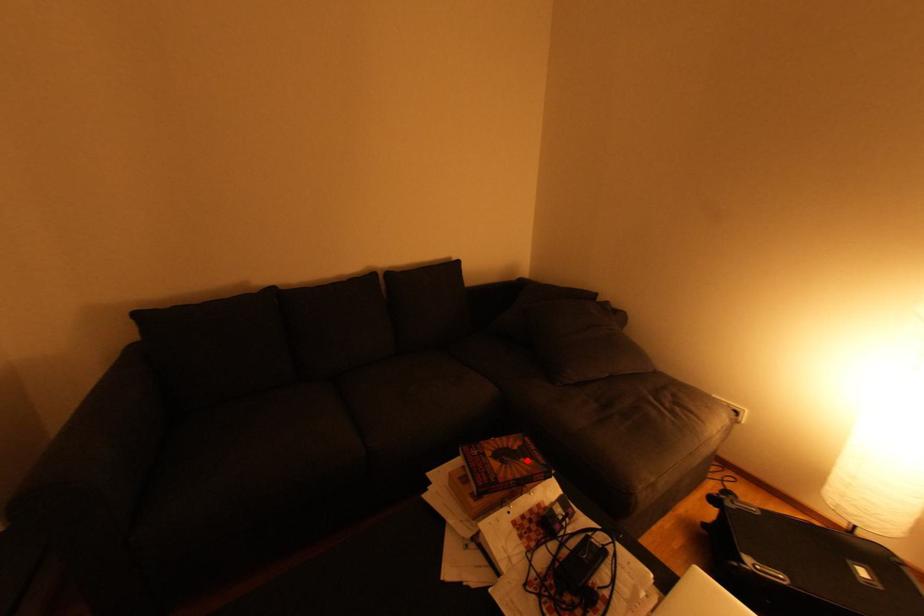
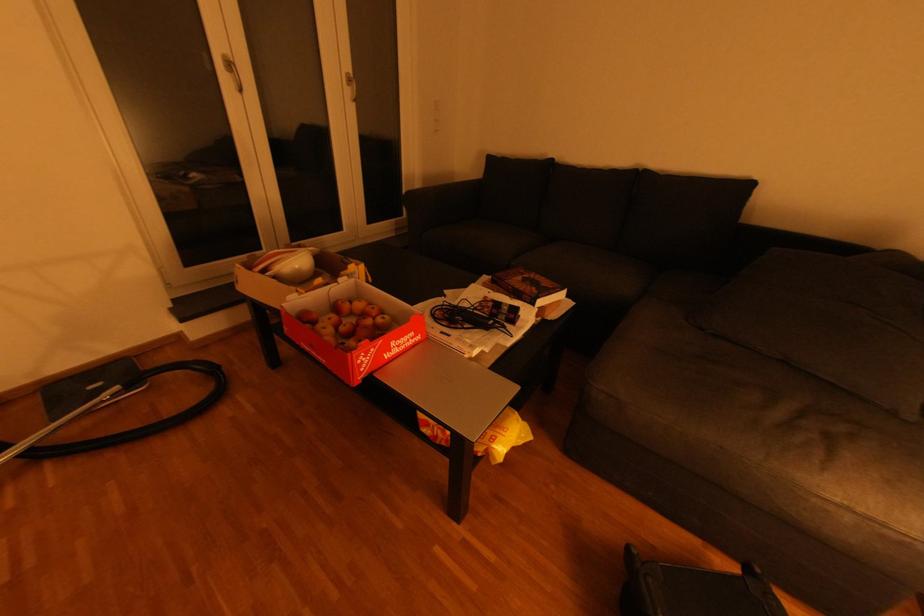
Where in the second image is the point corresponding to the highlighted location from the first image?

(539, 289)